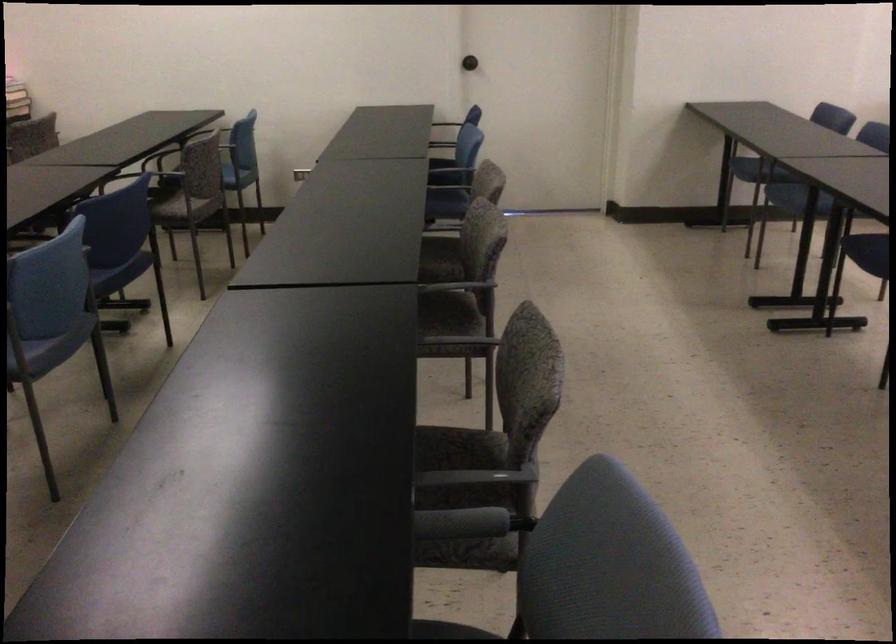
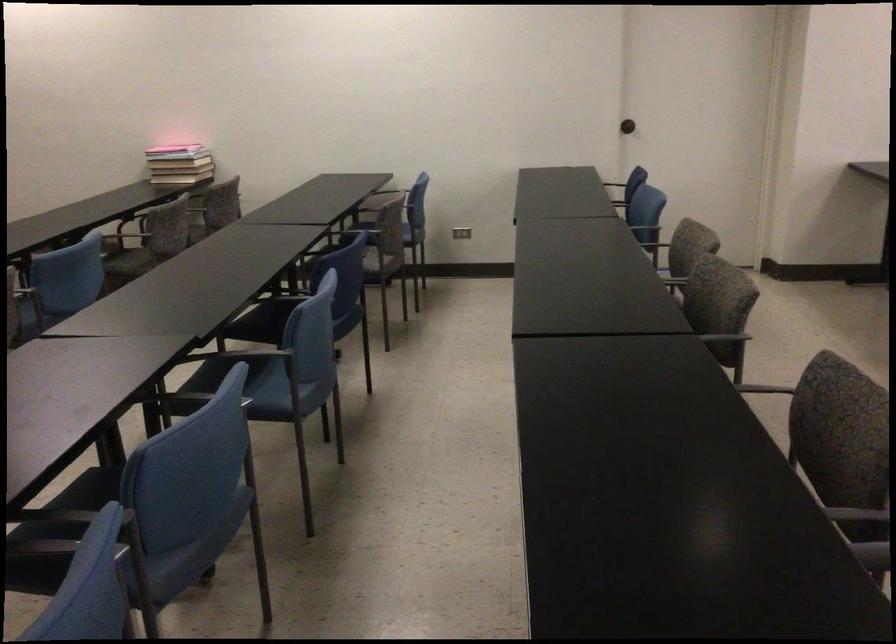
Find the pixel in the second image that matches [513,381] in the first image.

(837, 421)